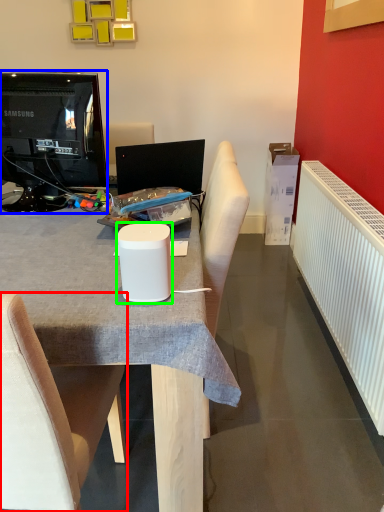
Question: Based on their relative distances, which object is farther from chair (highlighted by a red box)? Choose from television (highlighted by a blue box) and paper cup (highlighted by a green box).

Choices:
 (A) television
 (B) paper cup

Answer: (A)